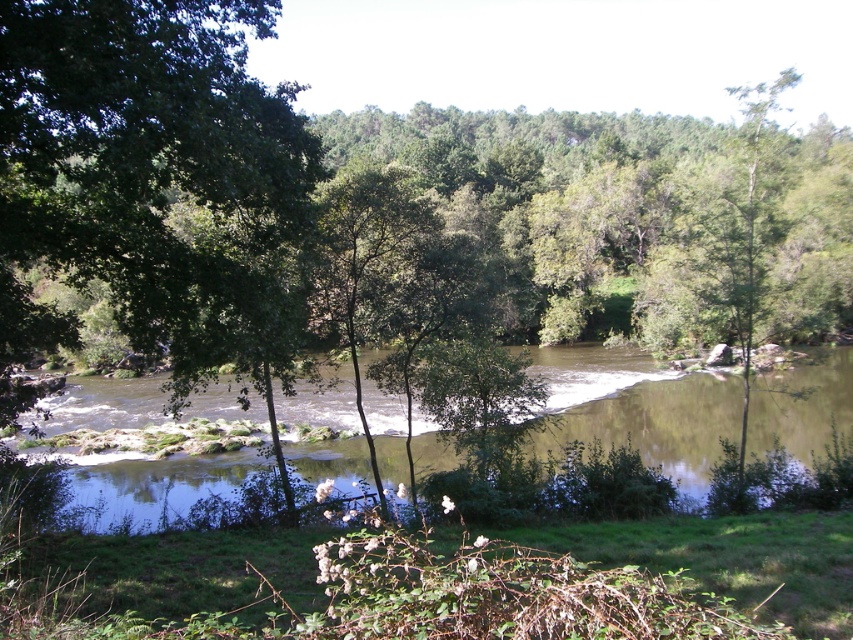
You are a hiker who wants to cross the brown smooth river at center using a 10 meter long rope. You see the green leafy tree at upper right. Can you tie the rope between the two objects to create a bridge?

The brown smooth river at center and green leafy tree at upper right are 13.88 meters apart from each other. The rope is only 10 meters long, so it is not long enough to span the distance between them. You cannot tie the rope between the two objects to create a bridge.

You are planning to cross the brown smooth river at center using a small wooden bridge. However, there is a green leafy tree at upper right nearby. Considering their heights, which one is shorter?

The brown smooth river at center has a lesser height compared to the green leafy tree at upper right, so the brown smooth river at center is shorter.